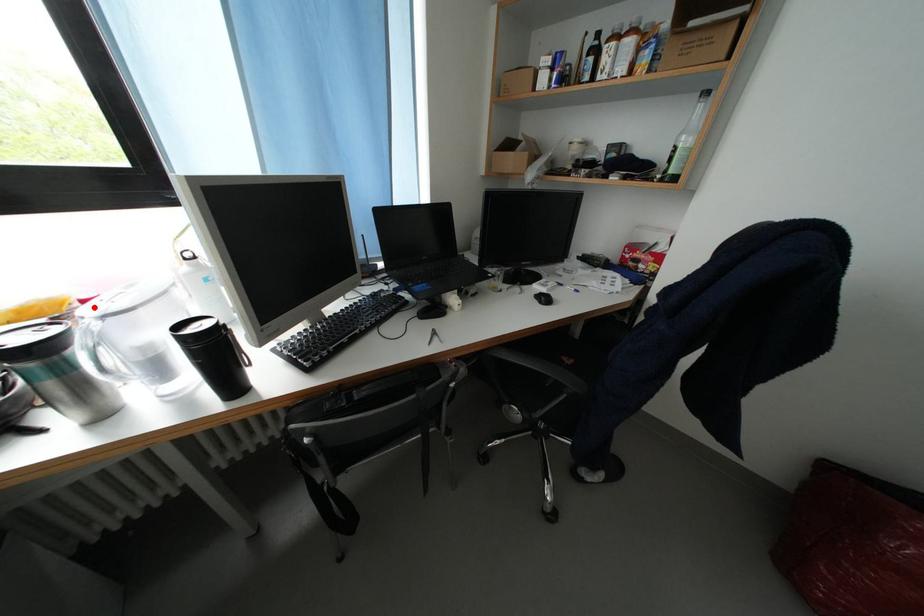
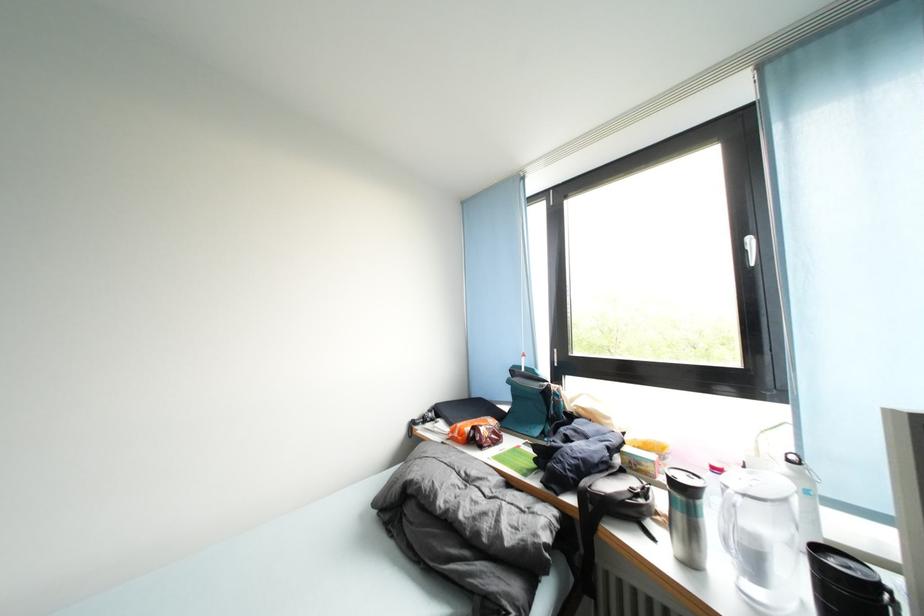
Find the pixel in the second image that matches the highlighted location in the first image.

(723, 475)